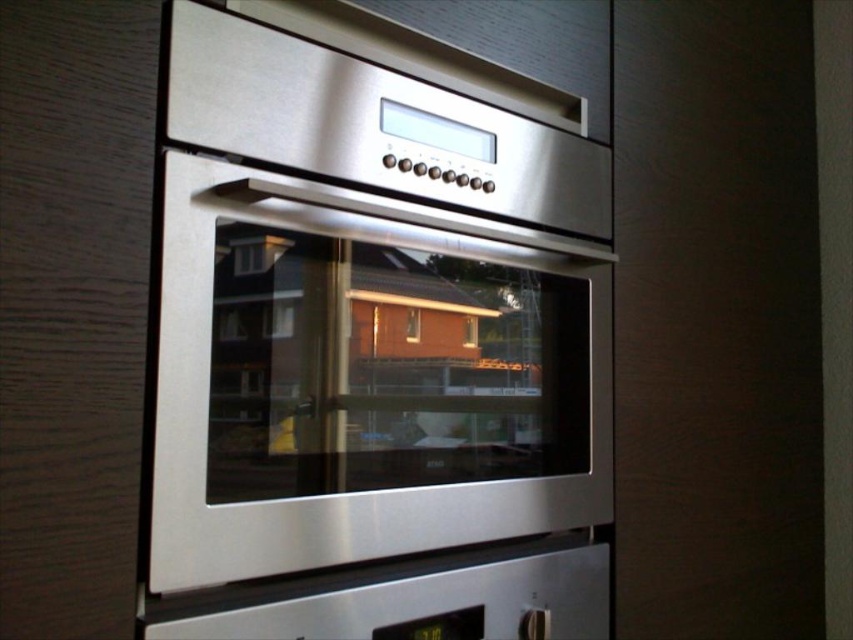
You are a kitchen designer planning to install a new microwave above the stainless steel oven at center. Where should the microwave be placed in relation to the satin metallic exhaust hood at upper center?

The stainless steel oven at center is positioned on the right side of the satin metallic exhaust hood at upper center. Therefore, the microwave should be placed to the left of the satin metallic exhaust hood at upper center to align with the oven.

You are standing in the kitchen and want to place a 20 inch wide cake pan in the oven. The point where you need to place the pan is at point (392, 426). Can the cake pan fit in the oven?

The distance between the points is 30.92 inches, so the cake pan will fit as it is wider than the required space.

What are the coordinates of the stainless steel oven at center?

The coordinates of the stainless steel oven at center are at point [372,355].